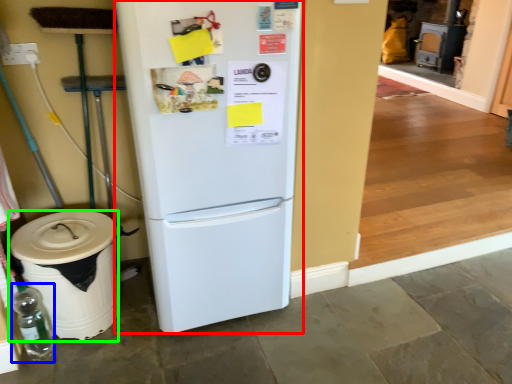
Question: Which is farther away from refrigerator (highlighted by a red box)? bottle (highlighted by a blue box) or trash bin/can (highlighted by a green box)?

Choices:
 (A) bottle
 (B) trash bin/can

Answer: (A)